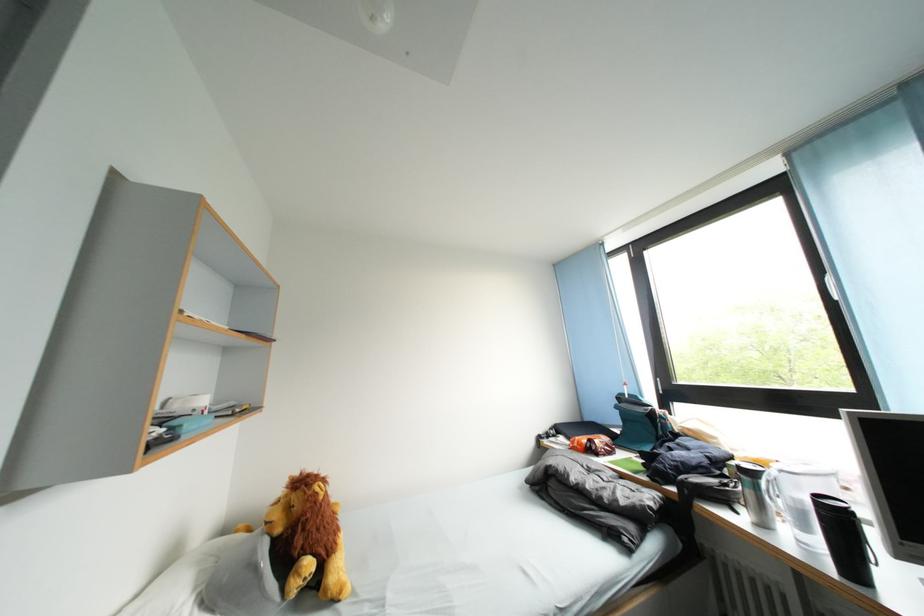
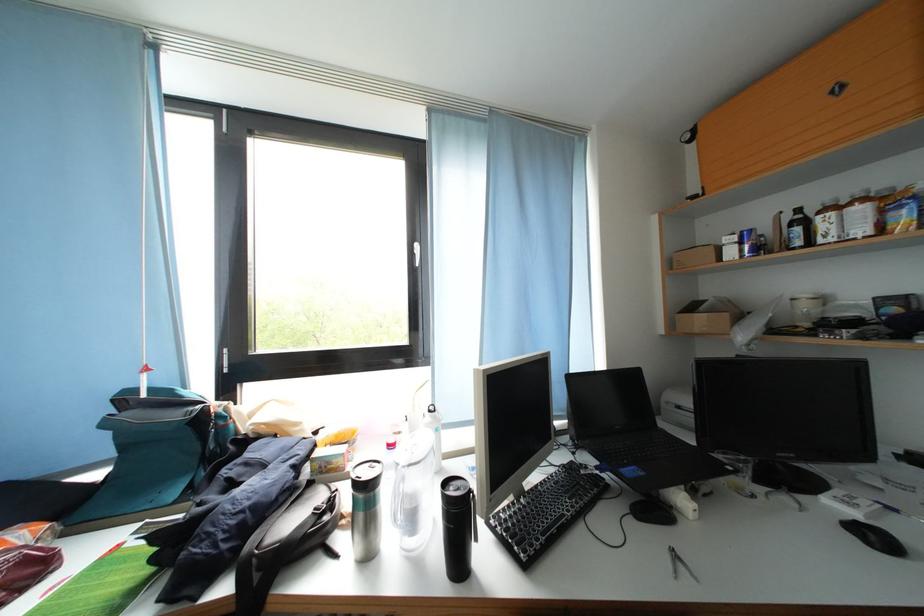
In the second image, find the point that corresponds to the point at 759,479 in the first image.

(380, 493)